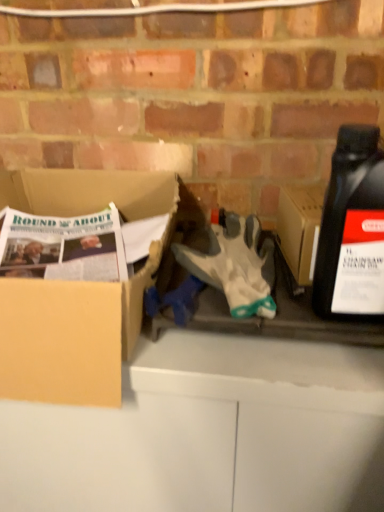
This screenshot has width=384, height=512. Find the location of `vacant space that is to the left of white fabric glove at center`. vacant space that is to the left of white fabric glove at center is located at coordinates tap(139, 314).